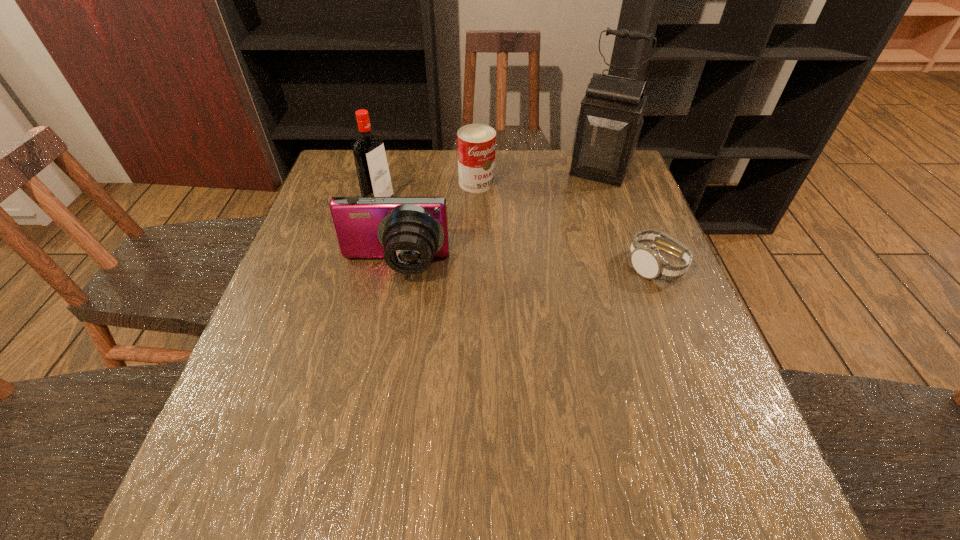
I want to click on free space that is in between the shortest object and the tallest object, so pyautogui.click(x=627, y=219).

I want to click on vacant space that is in between the can and the lantern, so click(539, 177).

Find the location of a particular element. This screenshot has width=960, height=540. object that ranks as the second closest to the vodka is located at coordinates (476, 143).

Where is `object identified as the closest to the third farthest object`? object identified as the closest to the third farthest object is located at coordinates (408, 232).

Where is `blank space that satisfies the following two spatial constraints: 1. on the back side of the lantern; 2. on the right side of the third object from right to left`? blank space that satisfies the following two spatial constraints: 1. on the back side of the lantern; 2. on the right side of the third object from right to left is located at coordinates (477, 172).